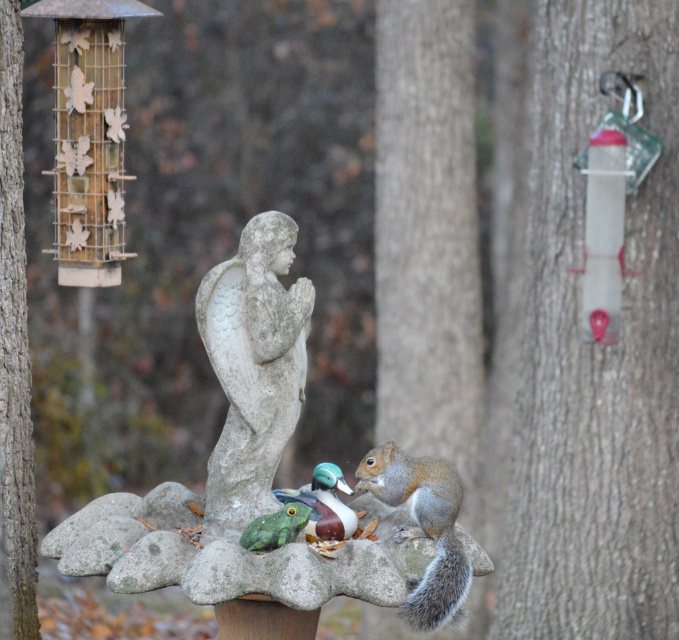
Question: Which of the following is the farthest from the observer?

Choices:
 (A) (318, 492)
 (B) (426, 474)
 (C) (20, 449)
 (D) (557, 564)

Answer: (D)

Question: Observing the image, what is the correct spatial positioning of smooth bark tree at right in reference to gray stone statue at center?

Choices:
 (A) below
 (B) above

Answer: (B)

Question: Observing the image, what is the correct spatial positioning of smooth brown bark at left in reference to green rubber frog at center?

Choices:
 (A) right
 (B) left

Answer: (B)

Question: Based on their relative distances, which object is farther from the gray furry squirrel at lower right?

Choices:
 (A) smooth brown bark at left
 (B) green rubber frog at center

Answer: (A)

Question: Based on their relative distances, which object is farther from the smooth brown bark at left?

Choices:
 (A) shiny green plastic duck at center
 (B) gray furry squirrel at lower right
 (C) gray stone statue at center

Answer: (B)

Question: Does smooth bark tree at right have a smaller size compared to gray furry squirrel at lower right?

Choices:
 (A) no
 (B) yes

Answer: (A)